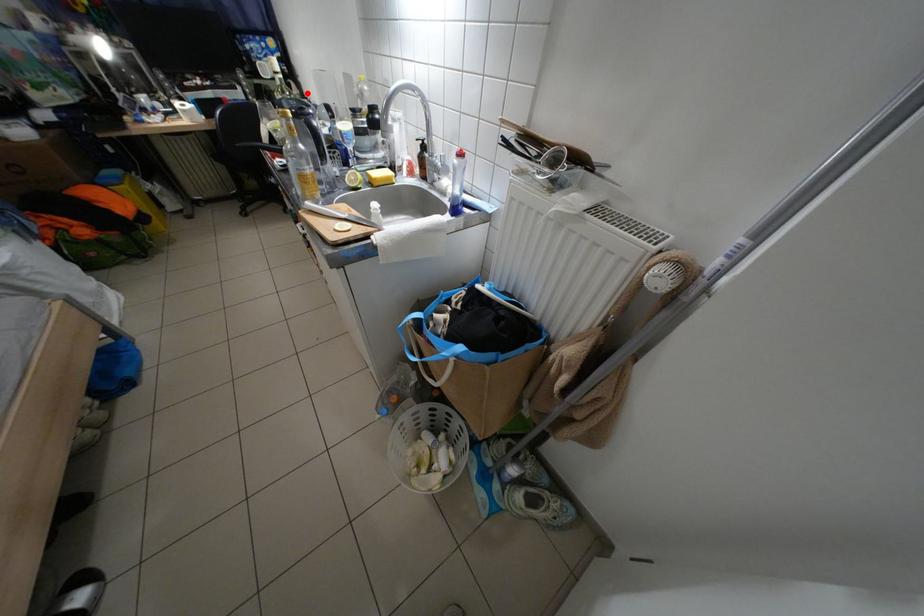
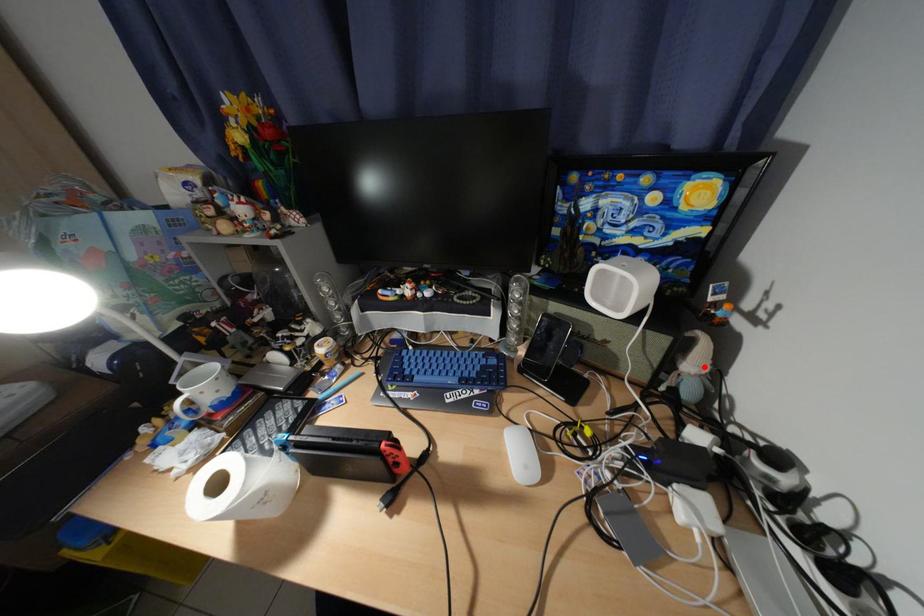
I am providing you with two images of the same scene from different viewpoints. A red point is marked on the first image and another point is marked on the second image. Is the red point in image1 aligned with the point shown in image2?

Yes